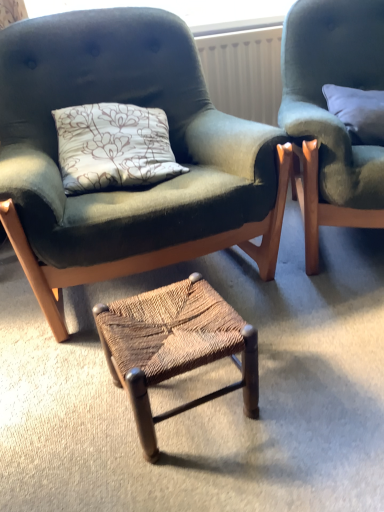
Question: Would you say white textured radiator at upper center is part of velvet green armchair at center, which is the 2th chair in right-to-left order,'s contents?

Choices:
 (A) yes
 (B) no

Answer: (B)

Question: Is velvet green armchair at center, acting as the first chair starting from the left, shorter than white textured radiator at upper center?

Choices:
 (A) yes
 (B) no

Answer: (B)

Question: From the image's perspective, is velvet green armchair at center, acting as the first chair starting from the left, located beneath white textured radiator at upper center?

Choices:
 (A) no
 (B) yes

Answer: (B)

Question: Is velvet green armchair at center, which is the 2th chair in right-to-left order, positioned in front of white textured radiator at upper center?

Choices:
 (A) yes
 (B) no

Answer: (A)

Question: Is velvet green armchair at center, which is the 2th chair in right-to-left order, not inside white textured radiator at upper center?

Choices:
 (A) yes
 (B) no

Answer: (A)

Question: Is velvet green armchair at center, acting as the first chair starting from the left, smaller than white textured radiator at upper center?

Choices:
 (A) yes
 (B) no

Answer: (B)

Question: Does woven wood stool at center have a greater width compared to velvet green armchair at center, acting as the first chair starting from the left?

Choices:
 (A) no
 (B) yes

Answer: (A)

Question: From a real-world perspective, does woven wood stool at center sit lower than velvet green armchair at center, which is the 2th chair in right-to-left order?

Choices:
 (A) no
 (B) yes

Answer: (B)

Question: Does woven wood stool at center have a larger size compared to velvet green armchair at center, which is the 2th chair in right-to-left order?

Choices:
 (A) no
 (B) yes

Answer: (A)

Question: Can you confirm if woven wood stool at center is taller than velvet green armchair at center, acting as the first chair starting from the left?

Choices:
 (A) yes
 (B) no

Answer: (B)

Question: Can you confirm if woven wood stool at center is positioned to the right of velvet green armchair at center, acting as the first chair starting from the left?

Choices:
 (A) no
 (B) yes

Answer: (B)

Question: Is the depth of woven wood stool at center greater than that of velvet green armchair at center, which is the 2th chair in right-to-left order?

Choices:
 (A) no
 (B) yes

Answer: (B)

Question: Does velvet green armchair at center, acting as the first chair starting from the left, have a greater height compared to woven wood stool at center?

Choices:
 (A) yes
 (B) no

Answer: (A)